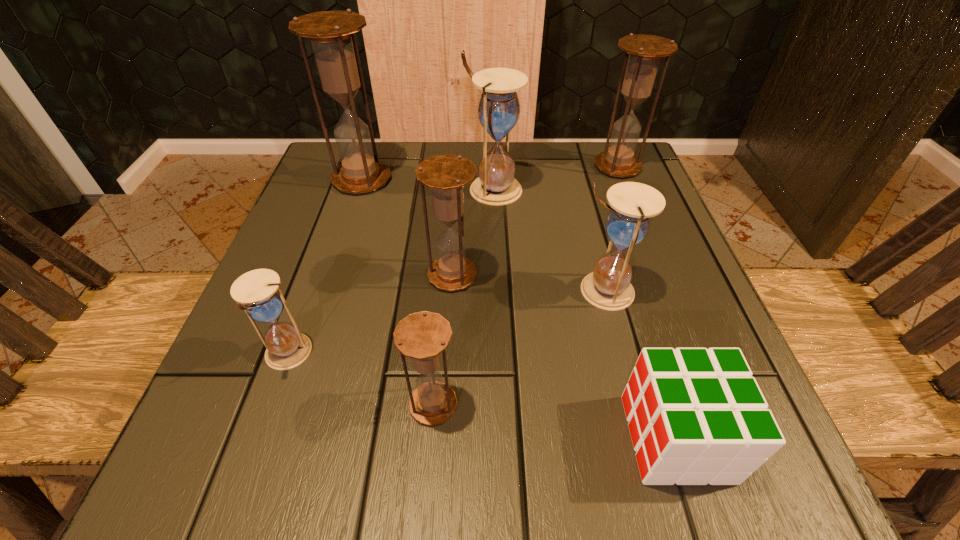
Where is `vacant space located 0.250m on the right of the smallest brown hourglass`? vacant space located 0.250m on the right of the smallest brown hourglass is located at coordinates (641, 404).

You are a GUI agent. You are given a task and a screenshot of the screen. Output one action in this format:
    pyautogui.click(x=<x>, y=<y>)
    Task: Click on the free space located on the red face of the shortest object
    
    Given the screenshot: What is the action you would take?
    click(497, 438)

Find the location of `vacant space situated on the red face of the shortest object`. vacant space situated on the red face of the shortest object is located at coordinates (342, 438).

At what (x,y) coordinates should I click in order to perform the action: click on vacant space located on the red face of the shortest object. Please return your answer as a coordinate pair (x, y). Looking at the image, I should click on (537, 438).

At what (x,y) coordinates should I click in order to perform the action: click on hourglass that is at the near edge. Please return your answer as a coordinate pair (x, y). Image resolution: width=960 pixels, height=540 pixels. Looking at the image, I should click on (422, 336).

Where is `cube situated at the near edge`? The height and width of the screenshot is (540, 960). cube situated at the near edge is located at coordinates (696, 416).

In order to click on cube located at the right edge in this screenshot , I will do `click(696, 416)`.

In order to click on object present at the far left corner in this screenshot , I will do `click(332, 33)`.

Locate an element on the screen. object that is at the far right corner is located at coordinates (645, 51).

Where is `object situated at the near right corner`? The width and height of the screenshot is (960, 540). object situated at the near right corner is located at coordinates (696, 416).